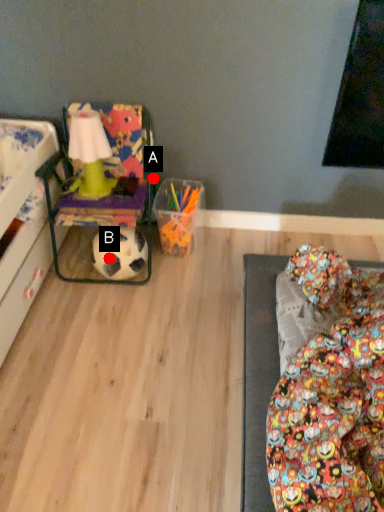
Question: Two points are circled on the image, labeled by A and B beside each circle. Among these points, which one is farthest from the camera?

Choices:
 (A) A is further
 (B) B is further

Answer: (A)